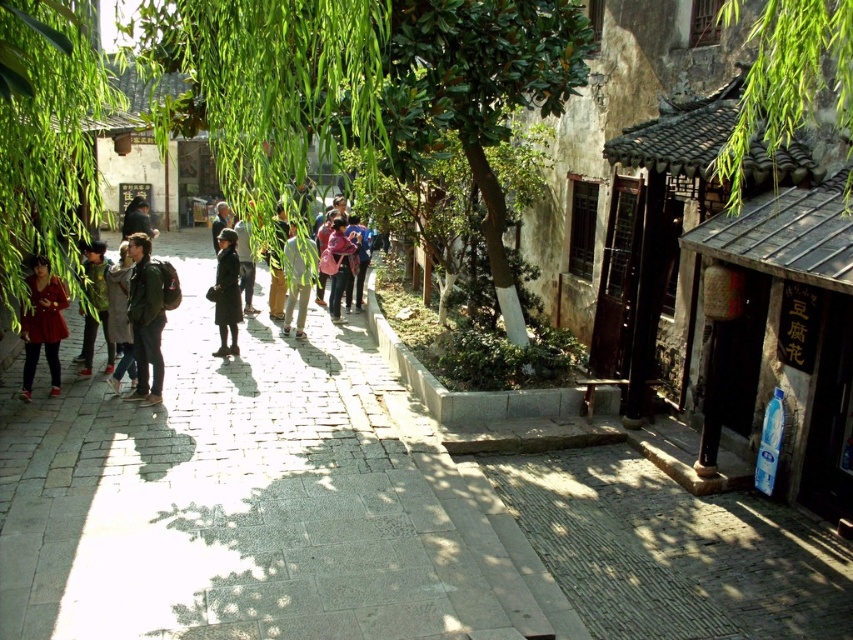
From the picture: Is green fabric jacket at left to the left of light brown leather jacket at center from the viewer's perspective?

Indeed, green fabric jacket at left is positioned on the left side of light brown leather jacket at center.

Is point (85, 368) closer to viewer compared to point (293, 300)?

Yes, point (85, 368) is in front of point (293, 300).

The width and height of the screenshot is (853, 640). I want to click on green fabric jacket at left, so click(x=97, y=291).

Is matte black coat at center shorter than green fabric jacket at left?

In fact, matte black coat at center may be taller than green fabric jacket at left.

Does matte black coat at center appear over green fabric jacket at left?

Yes, matte black coat at center is above green fabric jacket at left.

Is point (219, 307) more distant than point (105, 264)?

Yes, it is.

The height and width of the screenshot is (640, 853). I want to click on matte black coat at center, so click(225, 292).

Does matte red coat at left appear on the left side of green fabric jacket at left?

Indeed, matte red coat at left is positioned on the left side of green fabric jacket at left.

Between point (39, 337) and point (84, 328), which one is positioned in front?

Positioned in front is point (39, 337).

Find the location of `matte red coat at left`. matte red coat at left is located at coordinates (42, 324).